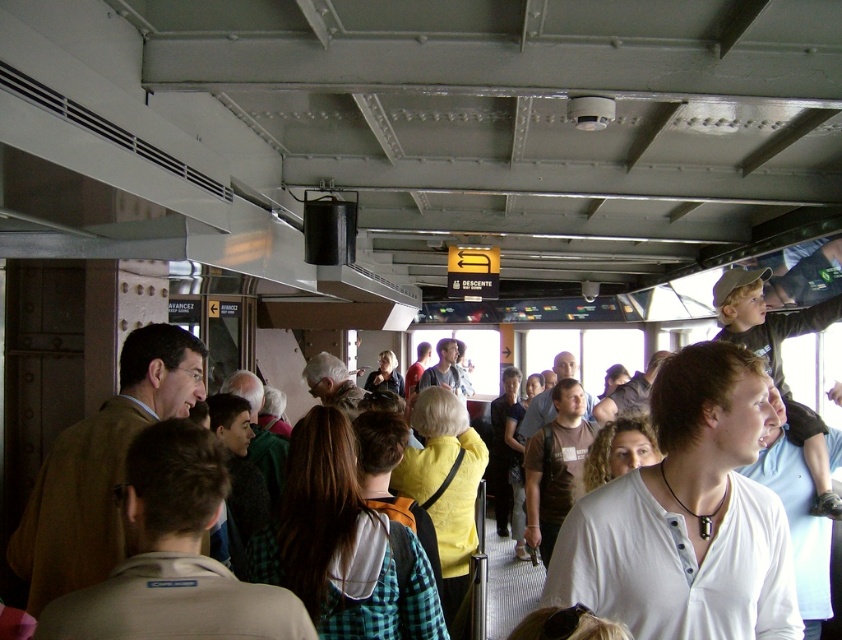
You are standing in the crowded transportation vehicle and want to reach the exit marked by the sign. You notice a white fabric shirt at lower left and a yellow shirt at center. Which shirt is closer to you as you move towards the exit?

The white fabric shirt at lower left is closer to the viewer than the yellow shirt at center, so the white fabric shirt at lower left would be closer as you move towards the exit.

You are taking a photo of the interior of the transportation vehicle. You want to focus on both the point at coordinates point (132, 556) and the point at coordinates point (496, 444). Which point should you focus on first to ensure both are in sharp focus?

You should focus on point (132, 556) first because it is closer to the camera, ensuring both points will be in focus when using a proper depth of field.

You are standing in the crowded transportation vehicle and notice two people wearing a green plaid shirt at center and a yellow shirt at center. Which person is shorter?

The green plaid shirt at center is shorter than the yellow shirt at center, so the person wearing the green plaid shirt at center is shorter.